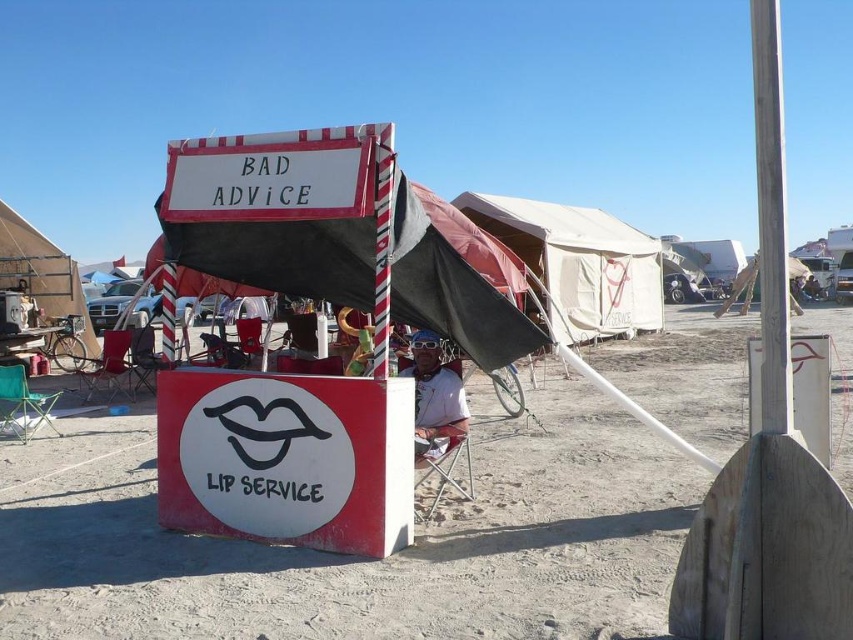
Can you confirm if matte black tent at left is wider than red and white striped pole at center?

Indeed, matte black tent at left has a greater width compared to red and white striped pole at center.

Does matte black tent at left appear over red and white striped pole at center?

Correct, matte black tent at left is located above red and white striped pole at center.

Locate an element on the screen. matte black tent at left is located at coordinates (42, 273).

Where is `matte black tent at left`? The width and height of the screenshot is (853, 640). matte black tent at left is located at coordinates (42, 273).

Is point (547, 278) positioned in front of point (750, 376)?

No, it is not.

From the picture: Who is higher up, white canvas tent at center or white painted wood sign at upper center?

white canvas tent at center is higher up.

Describe the element at coordinates (578, 262) in the screenshot. The image size is (853, 640). I see `white canvas tent at center` at that location.

At what (x,y) coordinates should I click in order to perform the action: click on white canvas tent at center. Please return your answer as a coordinate pair (x, y). Looking at the image, I should click on (578, 262).

Is dirt sand at center shorter than white matte sign at center?

No.

Where is `dirt sand at center`? This screenshot has width=853, height=640. dirt sand at center is located at coordinates (357, 557).